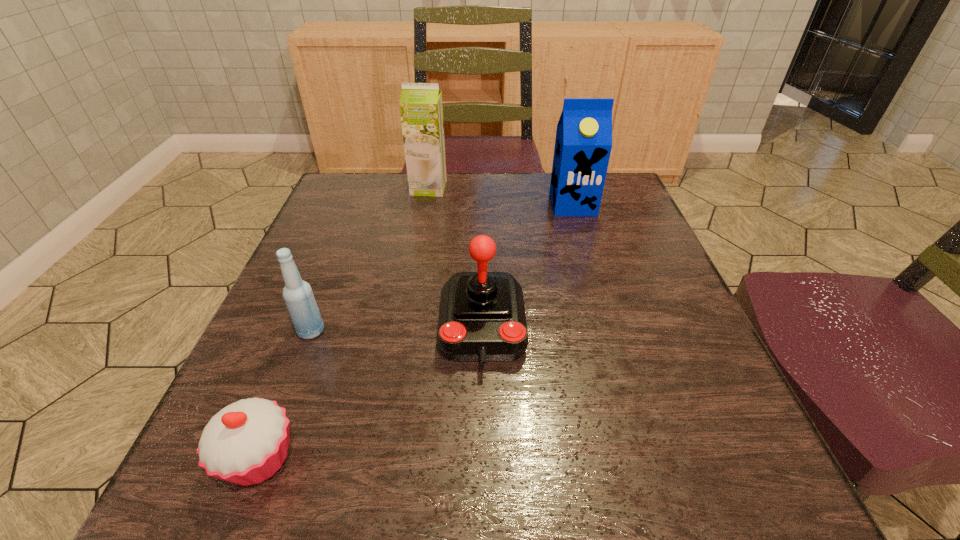
Where is `free space at the left edge of the desktop`? free space at the left edge of the desktop is located at coordinates (311, 369).

Identify the location of blank space at the right edge of the desktop. (636, 262).

The width and height of the screenshot is (960, 540). I want to click on vacant region at the near left corner, so click(x=187, y=512).

Locate an element on the screen. Image resolution: width=960 pixels, height=540 pixels. vacant space at the near right corner is located at coordinates (705, 496).

Find the location of `free space between the cupcake and the fourth object from left to right`. free space between the cupcake and the fourth object from left to right is located at coordinates (371, 393).

This screenshot has width=960, height=540. What are the coordinates of `empty space that is in between the third object from left to right and the rightmost object` in the screenshot? It's located at (501, 196).

You are a GUI agent. You are given a task and a screenshot of the screen. Output one action in this format:
    pyautogui.click(x=<x>, y=<y>)
    Task: Click on the free spot between the soya milk and the bottle
    Image resolution: width=960 pixels, height=540 pixels.
    Given the screenshot: What is the action you would take?
    pyautogui.click(x=370, y=259)

The height and width of the screenshot is (540, 960). In order to click on free spot between the rightmost object and the soya milk in this screenshot , I will do `click(501, 196)`.

At what (x,y) coordinates should I click in order to perform the action: click on vacant space that is in between the joystick and the cupcake. Please return your answer as a coordinate pair (x, y). Looking at the image, I should click on (371, 393).

Find the location of a particular element. The height and width of the screenshot is (540, 960). free space between the second object from right to left and the shortest object is located at coordinates (371, 393).